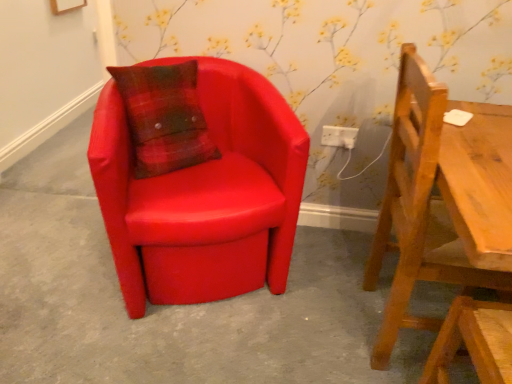
Image resolution: width=512 pixels, height=384 pixels. Identify the location of vacant space to the left of matte leather chair at left, the second chair viewed from the right. (57, 256).